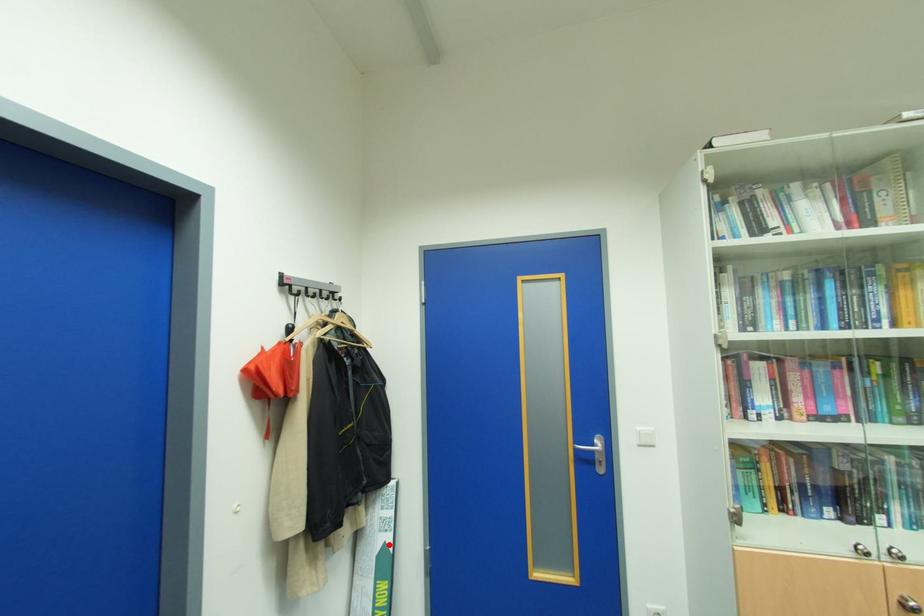
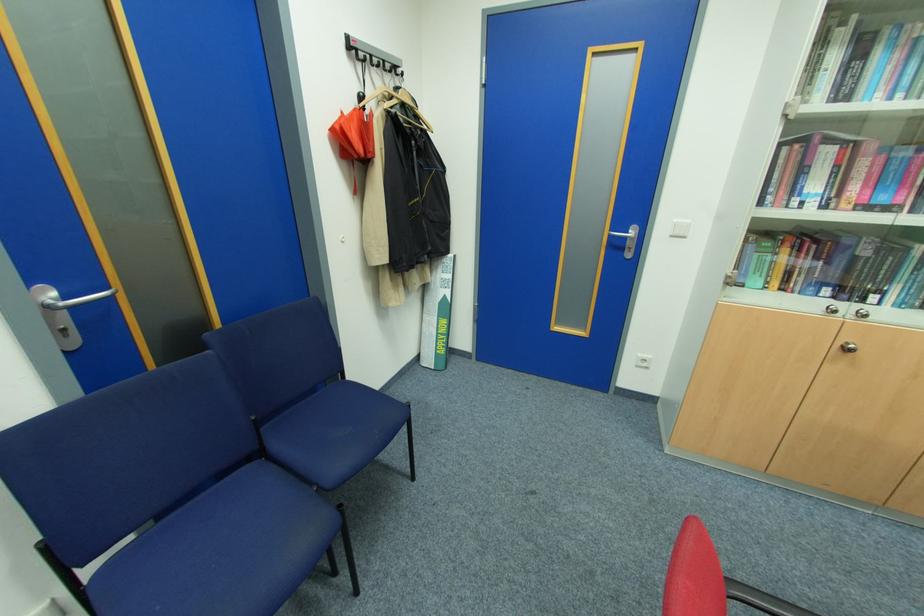
Where in the second image is the point corresponding to the highlighted location from the first image?

(448, 296)